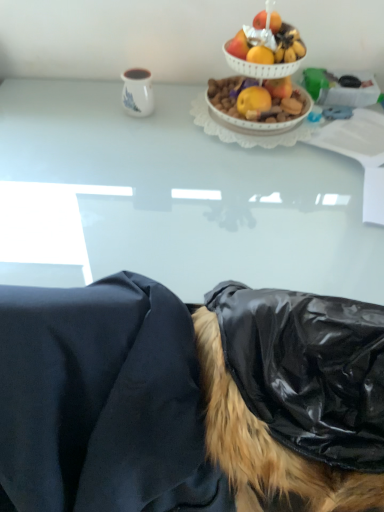
Image resolution: width=384 pixels, height=512 pixels. Find the location of `shiny white bowl at upper center`. shiny white bowl at upper center is located at coordinates (258, 60).

The height and width of the screenshot is (512, 384). Describe the element at coordinates (258, 60) in the screenshot. I see `shiny white bowl at upper center` at that location.

The height and width of the screenshot is (512, 384). What do you see at coordinates (171, 199) in the screenshot?
I see `white glossy table at upper center` at bounding box center [171, 199].

You are a GUI agent. You are given a task and a screenshot of the screen. Output one action in this format:
    pyautogui.click(x=<x>, y=<y>)
    Task: Click on the white ceramic mug at upper center
    Image resolution: width=384 pixels, height=512 pixels.
    Given the screenshot: What is the action you would take?
    pyautogui.click(x=137, y=92)

In order to face black fabric at lower center, should I rotate leftwards or rightwards?

Rotate your view left by about 15.605°.

The width and height of the screenshot is (384, 512). In order to click on shiny white bowl at upper center in this screenshot , I will do `click(258, 60)`.

Considering the relative sizes of white glossy table at upper center and shiny white bowl at upper center in the image provided, is white glossy table at upper center wider than shiny white bowl at upper center?

Yes, white glossy table at upper center is wider than shiny white bowl at upper center.

Could you tell me if white glossy table at upper center is facing shiny white bowl at upper center?

No, white glossy table at upper center is not facing towards shiny white bowl at upper center.

Consider the image. Does white glossy table at upper center have a lesser height compared to shiny white bowl at upper center?

No, white glossy table at upper center is not shorter than shiny white bowl at upper center.

Who is bigger, white glossy table at upper center or shiny white bowl at upper center?

With larger size is white glossy table at upper center.

In the scene shown: Which object is further away from the camera taking this photo, white glossy table at upper center or white ceramic mug at upper center?

white ceramic mug at upper center.

Is point (286, 219) farther from viewer compared to point (133, 70)?

No, (286, 219) is in front of (133, 70).

Does white glossy table at upper center contain white ceramic mug at upper center?

No, white ceramic mug at upper center is not a part of white glossy table at upper center.

Can you confirm if white glossy table at upper center is positioned to the left of white ceramic mug at upper center?

No.

Is the position of black fabric at lower center less distant than that of white glossy table at upper center?

Yes.

Does point (330, 487) come farther from viewer compared to point (184, 288)?

No, it is not.

Does black fabric at lower center touch white glossy table at upper center?

No, black fabric at lower center is not beside white glossy table at upper center.

Does black fabric at lower center turn towards white glossy table at upper center?

Yes, black fabric at lower center is turned towards white glossy table at upper center.

Is black fabric at lower center to the left or to the right of shiny white bowl at upper center in the image?

Result: black fabric at lower center is positioned on shiny white bowl at upper center's left side.

I want to click on fruit salad located above the black fabric at lower center (from a real-world perspective), so click(258, 60).

How many degrees apart are the facing directions of black fabric at lower center and shiny white bowl at upper center?

178 degrees separate the facing orientations of black fabric at lower center and shiny white bowl at upper center.

In the scene shown: Can you confirm if black fabric at lower center is thinner than shiny white bowl at upper center?

Incorrect, the width of black fabric at lower center is not less than that of shiny white bowl at upper center.

Looking at the image, does shiny white bowl at upper center seem bigger or smaller compared to white glossy table at upper center?

In the image, shiny white bowl at upper center appears to be smaller than white glossy table at upper center.

Is shiny white bowl at upper center thinner than white glossy table at upper center?

Correct, the width of shiny white bowl at upper center is less than that of white glossy table at upper center.

How different are the orientations of shiny white bowl at upper center and white glossy table at upper center in degrees?

1.3 degrees.

Where is `wig in front of the white ceramic mug at upper center`? wig in front of the white ceramic mug at upper center is located at coordinates (267, 445).

Does white ceramic mug at upper center lie in front of black glossy wig at lower right?

No, it is not.

Does white ceramic mug at upper center contain black glossy wig at lower right?

No.

From a real-world perspective, between black glossy wig at lower right and white glossy table at upper center, who is vertically lower?

From a 3D spatial view, white glossy table at upper center is below.

Is black glossy wig at lower right placed right next to white glossy table at upper center?

No.

You are a GUI agent. You are given a task and a screenshot of the screen. Output one action in this format:
    pyautogui.click(x=<x>, y=<y>)
    Task: Click on the desk in front of the shiny white bowl at upper center
    
    Given the screenshot: What is the action you would take?
    pyautogui.click(x=171, y=199)

Identify the location of coffee cup above the white glossy table at upper center (from a real-world perspective). This screenshot has height=512, width=384. (137, 92).

From the image, which object appears to be farther from shiny white bowl at upper center, white glossy table at upper center or black glossy wig at lower right?

Based on the image, black glossy wig at lower right appears to be further to shiny white bowl at upper center.

Looking at the image, which one is located closer to black glossy wig at lower right, white ceramic mug at upper center or white glossy table at upper center?

The object closer to black glossy wig at lower right is white glossy table at upper center.

Estimate the real-world distances between objects in this image. Which object is further from shiny white bowl at upper center, black glossy wig at lower right or white glossy table at upper center?

black glossy wig at lower right lies further to shiny white bowl at upper center than the other object.

When comparing their distances from black fabric at lower center, does black glossy wig at lower right or white glossy table at upper center seem further?

Based on the image, white glossy table at upper center appears to be further to black fabric at lower center.

Which object lies further to the anchor point white ceramic mug at upper center, shiny white bowl at upper center or black glossy wig at lower right?

black glossy wig at lower right lies further to white ceramic mug at upper center than the other object.

Looking at the image, which one is located further to shiny white bowl at upper center, white ceramic mug at upper center or black glossy wig at lower right?

black glossy wig at lower right is further to shiny white bowl at upper center.

Based on their spatial positions, is white ceramic mug at upper center or shiny white bowl at upper center closer to black glossy wig at lower right?

shiny white bowl at upper center lies closer to black glossy wig at lower right than the other object.

Considering their positions, is white glossy table at upper center positioned closer to black fabric at lower center than shiny white bowl at upper center?

white glossy table at upper center.

At what (x,y) coordinates should I click in order to perform the action: click on desk located between black fabric at lower center and black glossy wig at lower right in the left-right direction. Please return your answer as a coordinate pair (x, y). The width and height of the screenshot is (384, 512). Looking at the image, I should click on (171, 199).

The width and height of the screenshot is (384, 512). What are the coordinates of `coffee cup between shiny white bowl at upper center and white glossy table at upper center from top to bottom` in the screenshot? It's located at (137, 92).

At what (x,y) coordinates should I click in order to perform the action: click on coffee cup between shiny white bowl at upper center and black glossy wig at lower right in the vertical direction. Please return your answer as a coordinate pair (x, y). Looking at the image, I should click on (137, 92).

The width and height of the screenshot is (384, 512). What are the coordinates of `desk that lies between white ceramic mug at upper center and black fabric at lower center from top to bottom` in the screenshot? It's located at (171, 199).